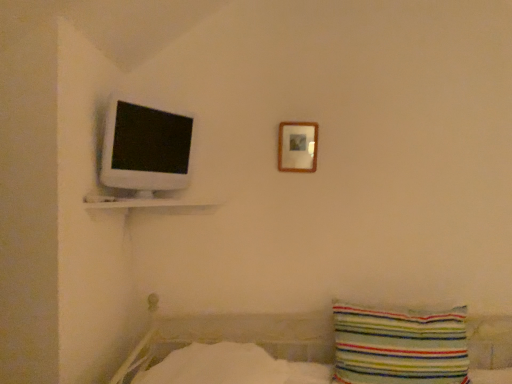
Measure the distance between striped fabric pillow at lower right and camera.

A distance of 5.38 feet exists between striped fabric pillow at lower right and camera.

What is the approximate width of striped fabric pillow at lower right?

It is 6.59 inches.

Where is `striped fabric pillow at lower right`? striped fabric pillow at lower right is located at coordinates (399, 346).

Which is nearer, (132, 200) or (362, 353)?

Clearly, point (132, 200) is closer to the camera than point (362, 353).

Between white glossy shelf at upper left and striped fabric pillow at lower right, which one has less height?

Standing shorter between the two is white glossy shelf at upper left.

Consider the image. Is white glossy shelf at upper left aimed at striped fabric pillow at lower right?

No, white glossy shelf at upper left is not turned towards striped fabric pillow at lower right.

Based on the photo, can you tell me how much white glossy shelf at upper left and striped fabric pillow at lower right differ in facing direction?

The angle between the facing direction of white glossy shelf at upper left and the facing direction of striped fabric pillow at lower right is 0.378 degrees.

In the image, is white soft bedsheet at lower center positioned in front of or behind striped fabric pillow at lower right?

Visually, white soft bedsheet at lower center is located in front of striped fabric pillow at lower right.

Which is correct: white soft bedsheet at lower center is inside striped fabric pillow at lower right, or outside of it?

The correct answer is: outside.

What's the angular difference between white soft bedsheet at lower center and striped fabric pillow at lower right's facing directions?

white soft bedsheet at lower center and striped fabric pillow at lower right are facing 2.56 degrees away from each other.

Which of these two, white soft bedsheet at lower center or striped fabric pillow at lower right, is bigger?

white soft bedsheet at lower center.

Which of these two, white glossy shelf at upper left or white soft bedsheet at lower center, is smaller?

Smaller between the two is white glossy shelf at upper left.

Do you think white glossy shelf at upper left is within white soft bedsheet at lower center, or outside of it?

white glossy shelf at upper left is not enclosed by white soft bedsheet at lower center.

Between white glossy shelf at upper left and white soft bedsheet at lower center, which one has larger width?

white soft bedsheet at lower center.

Is the surface of white glossy shelf at upper left in direct contact with white soft bedsheet at lower center?

white glossy shelf at upper left is not next to white soft bedsheet at lower center, and they're not touching.

This screenshot has height=384, width=512. In order to click on computer monitor lying behind the white soft bedsheet at lower center in this screenshot , I will do `click(145, 148)`.

In the scene shown: In terms of width, does white glossy computer monitor at upper left look wider or thinner when compared to white soft bedsheet at lower center?

Considering their sizes, white glossy computer monitor at upper left looks slimmer than white soft bedsheet at lower center.

From a real-world perspective, is white glossy computer monitor at upper left on top of white soft bedsheet at lower center?

Yes.

Can you confirm if striped fabric pillow at lower right is smaller than white glossy shelf at upper left?

No.

Is striped fabric pillow at lower right far from white glossy shelf at upper left?

No, striped fabric pillow at lower right is in close proximity to white glossy shelf at upper left.

I want to click on pillow that is below the white glossy shelf at upper left (from the image's perspective), so click(399, 346).

How distant is striped fabric pillow at lower right from white glossy shelf at upper left?

striped fabric pillow at lower right and white glossy shelf at upper left are 37.77 inches apart.

Is wooden picture frame at upper center to the right of white glossy shelf at upper left from the viewer's perspective?

Yes, wooden picture frame at upper center is to the right of white glossy shelf at upper left.

How many degrees apart are the facing directions of wooden picture frame at upper center and white glossy shelf at upper left?

There is a 0.04-degree angle between the facing directions of wooden picture frame at upper center and white glossy shelf at upper left.

From the image's perspective, relative to white glossy shelf at upper left, is wooden picture frame at upper center above or below?

wooden picture frame at upper center is situated higher than white glossy shelf at upper left in the image.

Is wooden picture frame at upper center positioned far away from white glossy shelf at upper left?

Actually, wooden picture frame at upper center and white glossy shelf at upper left are a little close together.

From the picture: Is white soft bedsheet at lower center positioned with its back to wooden picture frame at upper center?

No, white soft bedsheet at lower center is not facing the opposite direction of wooden picture frame at upper center.

Is there a large distance between white soft bedsheet at lower center and wooden picture frame at upper center?

Actually, white soft bedsheet at lower center and wooden picture frame at upper center are a little close together.

Which is behind, white soft bedsheet at lower center or wooden picture frame at upper center?

wooden picture frame at upper center is behind.

Between white soft bedsheet at lower center and wooden picture frame at upper center, which one has larger width?

With larger width is white soft bedsheet at lower center.

You are a GUI agent. You are given a task and a screenshot of the screen. Output one action in this format:
    pyautogui.click(x=<x>, y=<y>)
    Task: Click on the shelf on the left side of striped fabric pillow at lower right
    This screenshot has width=512, height=384.
    Given the screenshot: What is the action you would take?
    pyautogui.click(x=146, y=202)

Locate an element on the screen. Image resolution: width=512 pixels, height=384 pixels. pillow located on the right of white soft bedsheet at lower center is located at coordinates coord(399,346).

Which object lies further to the anchor point white soft bedsheet at lower center, striped fabric pillow at lower right or white glossy shelf at upper left?

white glossy shelf at upper left lies further to white soft bedsheet at lower center than the other object.

Which object lies nearer to the anchor point wooden picture frame at upper center, white glossy computer monitor at upper left or white soft bedsheet at lower center?

Based on the image, white glossy computer monitor at upper left appears to be nearer to wooden picture frame at upper center.

Based on their spatial positions, is white glossy computer monitor at upper left or wooden picture frame at upper center further from white glossy shelf at upper left?

Among the two, wooden picture frame at upper center is located further to white glossy shelf at upper left.

Looking at this image, based on their spatial positions, is white soft bedsheet at lower center or striped fabric pillow at lower right further from white glossy computer monitor at upper left?

striped fabric pillow at lower right is further to white glossy computer monitor at upper left.

Considering their positions, is white glossy shelf at upper left positioned further to striped fabric pillow at lower right than wooden picture frame at upper center?

The object further to striped fabric pillow at lower right is white glossy shelf at upper left.

Considering their positions, is white glossy shelf at upper left positioned further to wooden picture frame at upper center than white soft bedsheet at lower center?

white soft bedsheet at lower center is further to wooden picture frame at upper center.

When comparing their distances from wooden picture frame at upper center, does striped fabric pillow at lower right or white glossy shelf at upper left seem further?

striped fabric pillow at lower right lies further to wooden picture frame at upper center than the other object.

When comparing their distances from wooden picture frame at upper center, does white glossy computer monitor at upper left or white glossy shelf at upper left seem closer?

The object closer to wooden picture frame at upper center is white glossy shelf at upper left.

Identify the location of sheet located between white glossy shelf at upper left and striped fabric pillow at lower right in the left-right direction. (218, 366).

This screenshot has width=512, height=384. Identify the location of pillow that lies between wooden picture frame at upper center and white soft bedsheet at lower center from top to bottom. (399, 346).

At what (x,y) coordinates should I click in order to perform the action: click on shelf between white glossy computer monitor at upper left and striped fabric pillow at lower right in the horizontal direction. Please return your answer as a coordinate pair (x, y). Looking at the image, I should click on (146, 202).

In order to click on picture frame located between white glossy shelf at upper left and striped fabric pillow at lower right in the left-right direction in this screenshot , I will do `click(297, 146)`.